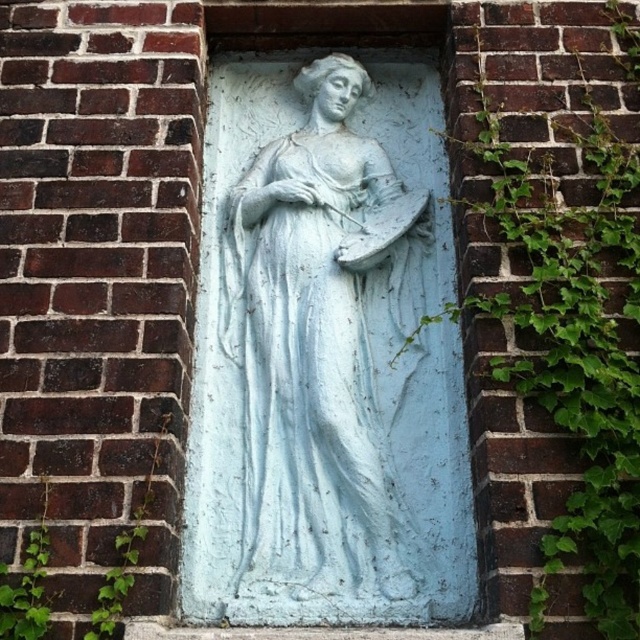
Who is higher up, green leafy ivy at right or white stone sculpture at center?

Positioned higher is green leafy ivy at right.

Does point (460, 22) come farther from viewer compared to point (368, 573)?

Yes, it is behind point (368, 573).

Where is `green leafy ivy at right`? Image resolution: width=640 pixels, height=640 pixels. green leafy ivy at right is located at coordinates (541, 300).